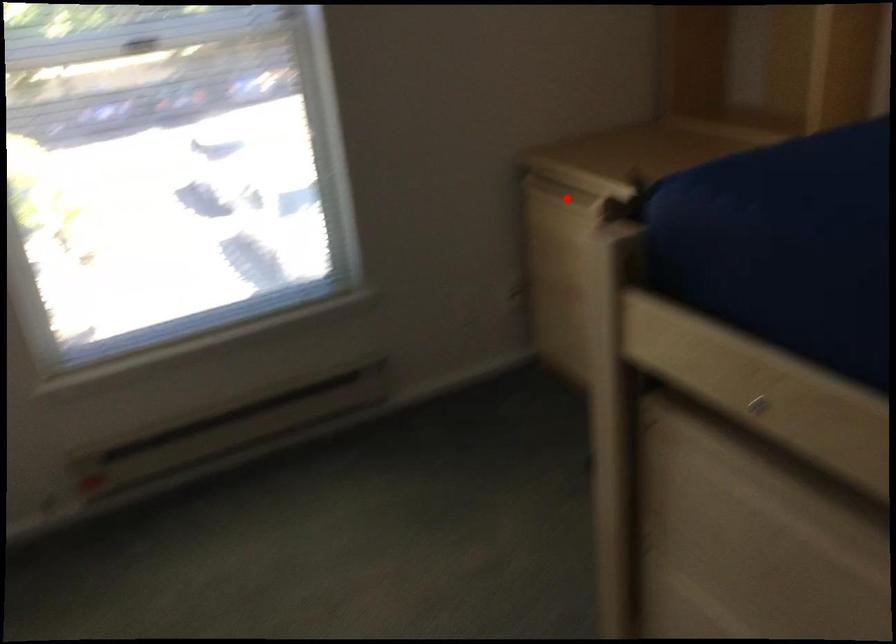
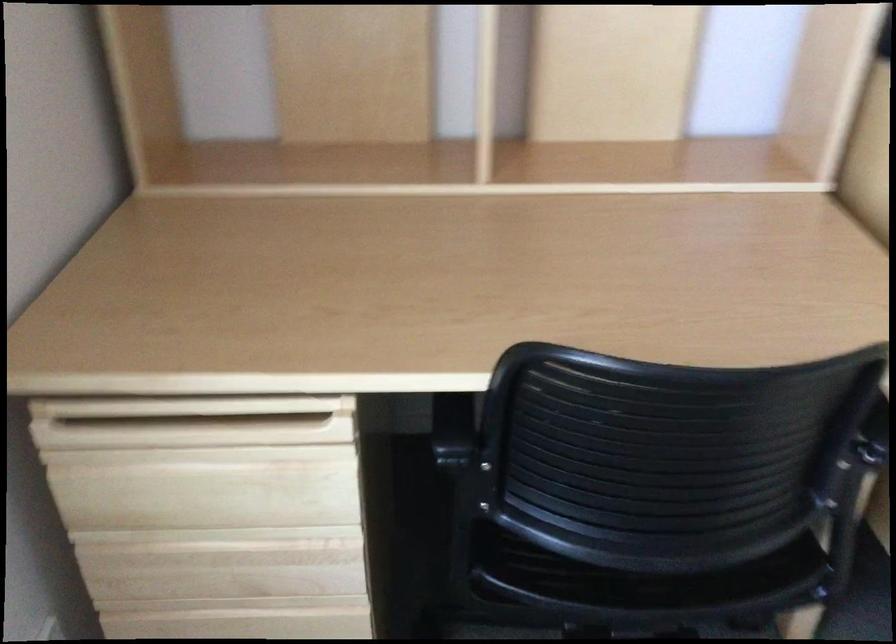
The point at the highlighted location is marked in the first image. Where is the corresponding point in the second image?

(192, 422)